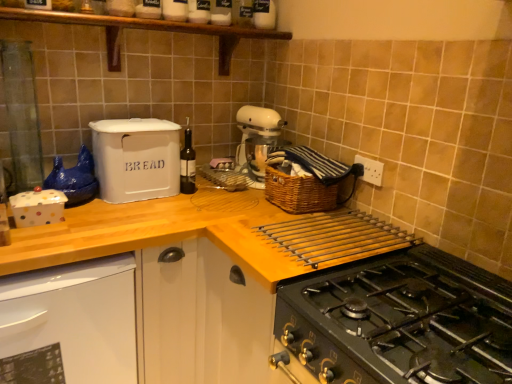
This screenshot has height=384, width=512. I want to click on free space that is in between white matte bread bin at upper left and woven brown basket at upper right, so click(209, 204).